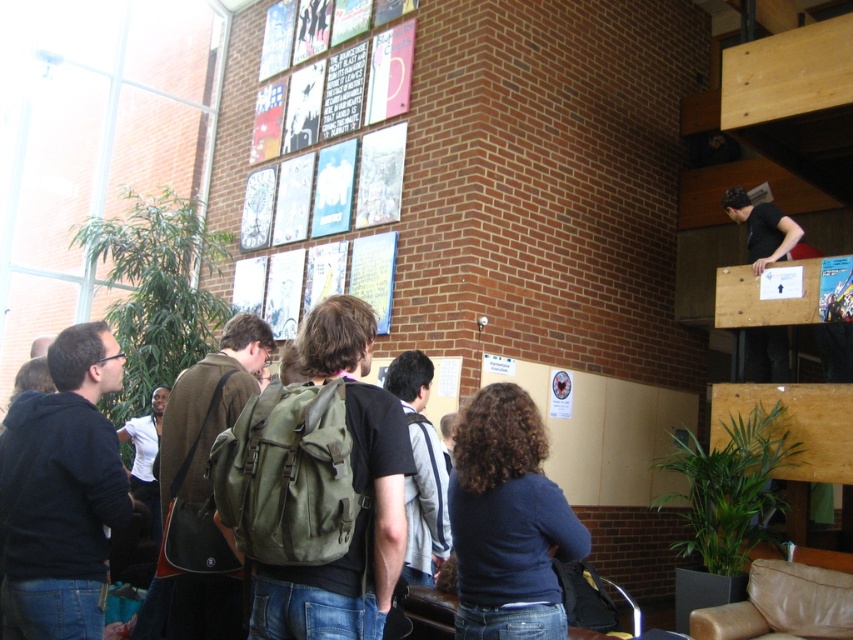
You are a photographer standing in the community center and want to capture a photo of the dark blue hoodie at center without the matte paper posters at upper center appearing in the frame. Is this possible given their relative heights?

The matte paper posters at upper center are taller than the dark blue hoodie at center, so if you lower your camera angle to focus on the hoodie, you can avoid including the posters in the frame.

You are an event organizer who wants to hang a new poster between the matte paper posters at upper center and the blue glossy poster at upper center. Based on their current positions, where should you place the new poster?

The matte paper posters at upper center are located above the blue glossy poster at upper center. Therefore, to place the new poster between them, you should position it below the matte paper posters at upper center and above the blue glossy poster at upper center.

Looking at this image, you are a photographer standing in the community center and want to take a photo of both the matte paper posters at upper center and the dark blue hoodie at center. Which object will appear larger in the photo?

The matte paper posters at upper center will appear larger in the photo because they are closer to the viewer than the dark blue hoodie at center.